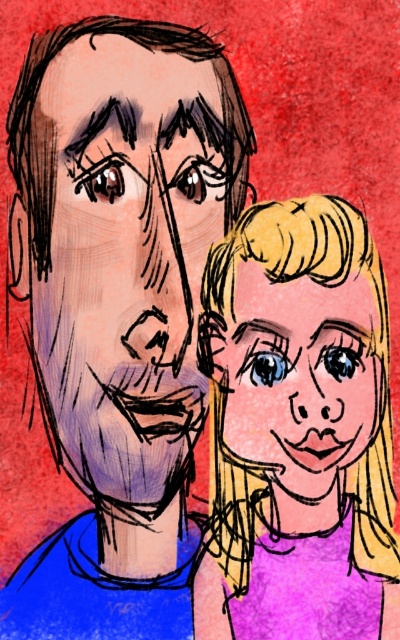
Is purple matte hair at right smaller than smooth blonde hair at center?

No, purple matte hair at right is not smaller than smooth blonde hair at center.

Is point (289, 282) positioned in front of point (231, 390)?

Yes, point (289, 282) is closer to viewer.

Image resolution: width=400 pixels, height=640 pixels. Describe the element at coordinates (297, 428) in the screenshot. I see `purple matte hair at right` at that location.

Where is `purple matte hair at right`? The height and width of the screenshot is (640, 400). purple matte hair at right is located at coordinates (297, 428).

Does matte purple face at center have a larger size compared to smooth blonde hair at center?

Correct, matte purple face at center is larger in size than smooth blonde hair at center.

Between point (158, 449) and point (358, 296), which one is positioned behind?

Point (158, 449)

The width and height of the screenshot is (400, 640). What are the coordinates of `matte purple face at center` in the screenshot? It's located at (128, 259).

Does purple matte hair at right appear under matte purple face at center?

Indeed, purple matte hair at right is positioned under matte purple face at center.

Can you confirm if purple matte hair at right is positioned to the left of matte purple face at center?

Incorrect, purple matte hair at right is not on the left side of matte purple face at center.

Does point (362, 605) come in front of point (162, 150)?

Yes.

Find the location of a particular element. purple matte hair at right is located at coordinates tap(297, 428).